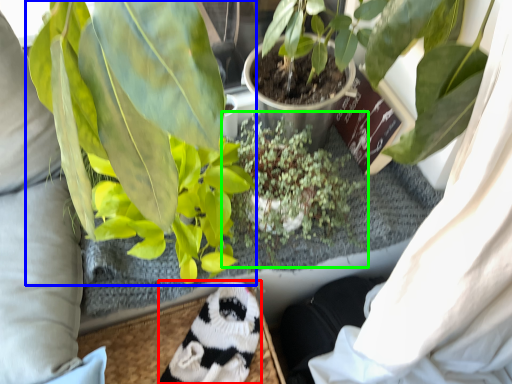
Question: Considering the real-world distances, which object is closest to animal (highlighted by a red box)? houseplant (highlighted by a blue box) or houseplant (highlighted by a green box).

Choices:
 (A) houseplant
 (B) houseplant

Answer: (B)